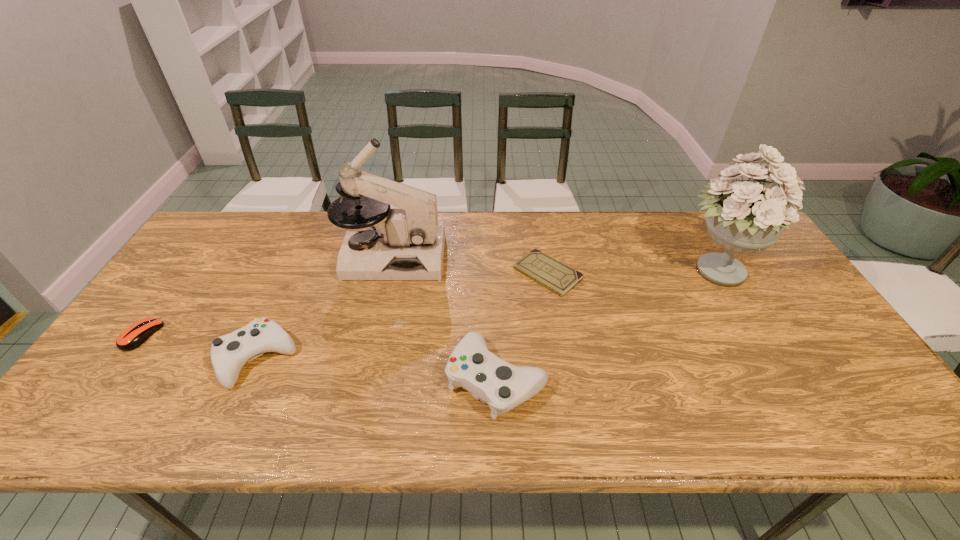
Find the location of `vacant space in between the third object from left to right and the shortest object`. vacant space in between the third object from left to right and the shortest object is located at coordinates (469, 265).

This screenshot has width=960, height=540. I want to click on free space between the leftmost object and the checkbook, so click(345, 305).

Where is `free space between the fifth tallest object and the third object from left to right`? Image resolution: width=960 pixels, height=540 pixels. free space between the fifth tallest object and the third object from left to right is located at coordinates (267, 296).

At what (x,y) coordinates should I click in order to perform the action: click on empty space between the shortest object and the left control. Please return your answer as a coordinate pair (x, y). The image size is (960, 540). Looking at the image, I should click on (402, 316).

Point out which object is positioned as the fifth nearest to the microscope. Please provide its 2D coordinates. Your answer should be formatted as a tuple, i.e. [(x, y)], where the tuple contains the x and y coordinates of a point satisfying the conditions above.

[(746, 217)]

In order to click on the third closest object to the bouquet in this screenshot , I will do `click(406, 244)`.

Identify the location of vacant space that satisfies the following two spatial constraints: 1. on the back side of the leftmost object; 2. on the right side of the shortest object. (186, 274).

Locate an element on the screen. The width and height of the screenshot is (960, 540). vacant area that satisfies the following two spatial constraints: 1. on the front side of the right control; 2. on the right side of the shorter control is located at coordinates (248, 379).

What are the coordinates of `vacant space that satisfies the following two spatial constraints: 1. on the back side of the shortest object; 2. on the left side of the rightmost object` in the screenshot? It's located at (547, 271).

Where is `vacant space that satisfies the following two spatial constraints: 1. at the eyepiece of the rightmost object; 2. on the left side of the fourth object from right to left`? This screenshot has height=540, width=960. vacant space that satisfies the following two spatial constraints: 1. at the eyepiece of the rightmost object; 2. on the left side of the fourth object from right to left is located at coordinates (389, 271).